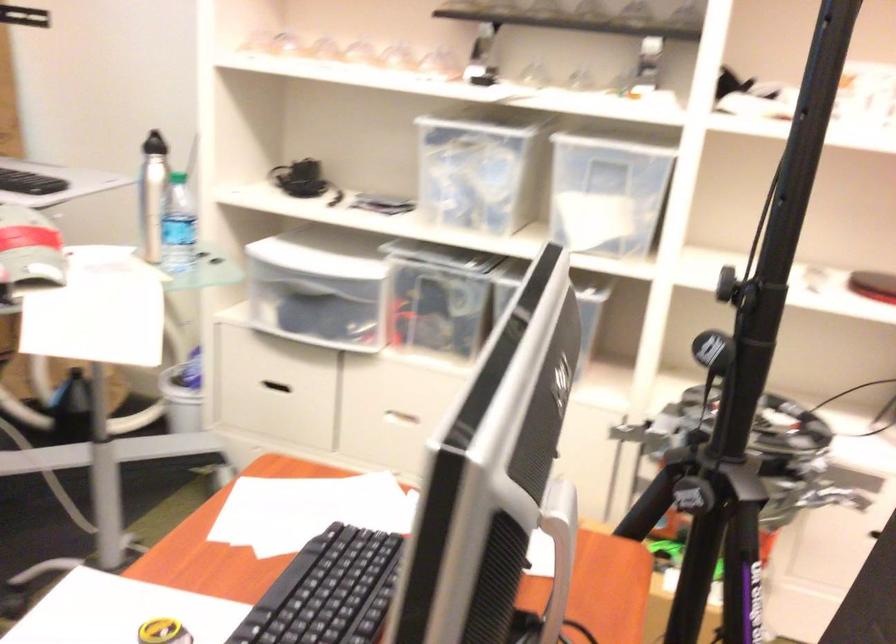
At what (x,y) coordinates should I click in order to perform the action: click on silver water bottle. Please return your answer as a coordinate pair (x, y). This screenshot has height=644, width=896. Looking at the image, I should click on (177, 225).